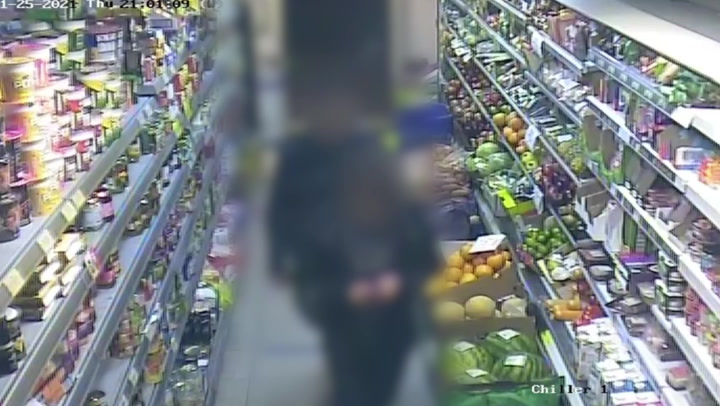
This screenshot has width=720, height=406. Find the location of `tiled floor`. tiled floor is located at coordinates (253, 372).